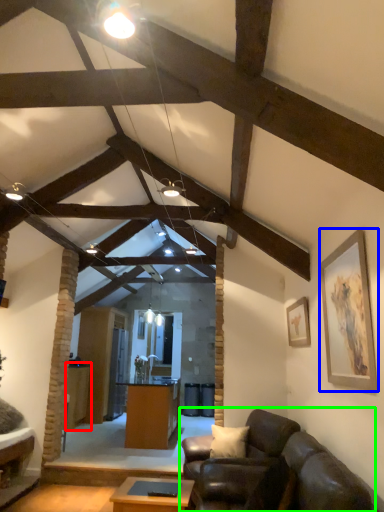
Question: Which is nearer to the table (highlighted by a red box)? picture frame (highlighted by a blue box) or studio couch (highlighted by a green box).

Choices:
 (A) picture frame
 (B) studio couch

Answer: (B)